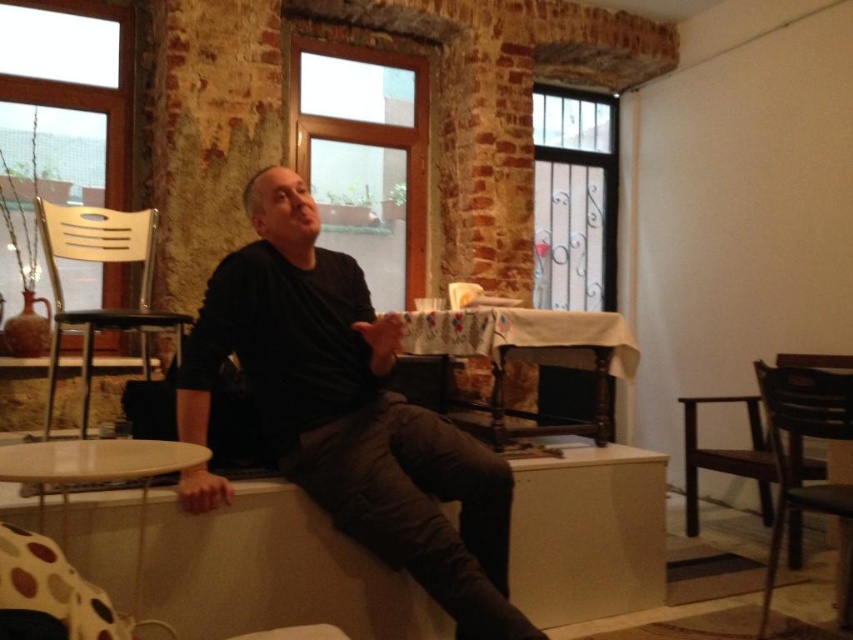
Is point (399, 163) positioned in front of point (585, 288)?

Yes, point (399, 163) is closer to viewer.

Does clear glass window at center have a smaller size compared to clear glass window at upper center?

No, clear glass window at center is not smaller than clear glass window at upper center.

Describe the element at coordinates (364, 157) in the screenshot. I see `clear glass window at center` at that location.

In order to click on clear glass window at center in this screenshot , I will do `click(364, 157)`.

Measure the distance from black matte shirt at center to brown wooden chair at lower right.

black matte shirt at center is 1.26 meters away from brown wooden chair at lower right.

In the scene shown: Between black matte shirt at center and brown wooden chair at lower right, which one is positioned lower?

brown wooden chair at lower right is lower down.

Is point (386, 525) behind point (767, 392)?

No.

The width and height of the screenshot is (853, 640). Find the location of `black matte shirt at center`. black matte shirt at center is located at coordinates (350, 412).

Locate an element on the screen. The width and height of the screenshot is (853, 640). clear glass window at center is located at coordinates (364, 157).

Is point (408, 92) positioned behind point (154, 228)?

Yes, it is.

This screenshot has width=853, height=640. In order to click on clear glass window at center in this screenshot , I will do `click(364, 157)`.